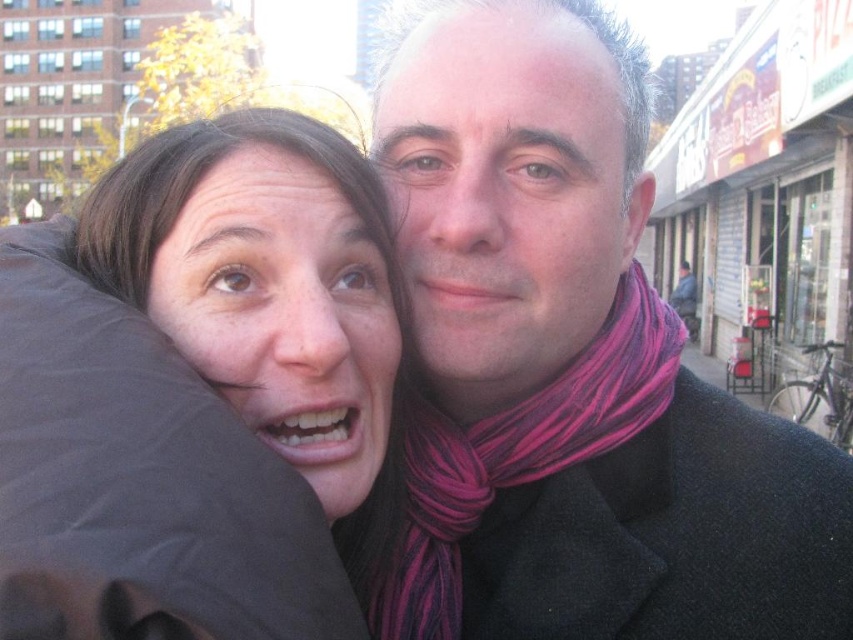
You are a photographer trying to capture a candid shot of the two people in the scene. You need to position yourself so that you can focus on both the dark wool scarf at center and the matte black jacket at left without moving the camera. Given that your camera has a maximum focus range of 6 meters, will you be able to capture both objects in focus?

The dark wool scarf at center is 6.76 meters from the matte black jacket at left. Since the distance between them exceeds the camera maximum focus range of 6 meters, you won not be able to capture both objects in focus without adjusting your position or equipment.

You are standing in an urban street scene with two people in front of you. The woman on the left has a surprised expression, and the man on the right wears a pink and purple striped scarf. There is a point marked at coordinates point (422, 406). Can you determine if this point is closer to you than 20 meters?

The distance of point (422, 406) from viewer is 19.17 meters, so yes, the point is closer than 20 meters.

You are a fashion designer observing two scarves in an urban setting. The dark wool scarf at center and the pink striped scarf at right are part of the outfits. Which scarf is positioned more to the left in the image?

The pink striped scarf at right is positioned more to the left because the dark wool scarf at center is to the right of it.